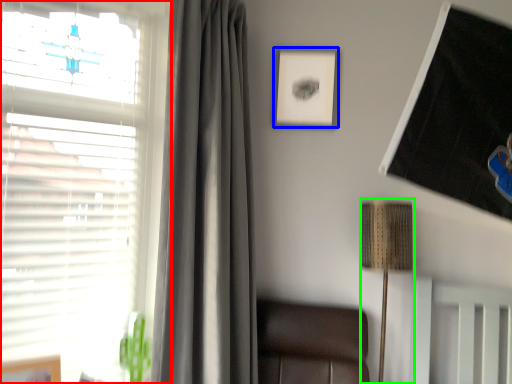
Question: Estimate the real-world distances between objects in this image. Which object is closer to window (highlighted by a red box), picture frame (highlighted by a blue box) or lamp (highlighted by a green box)?

Choices:
 (A) picture frame
 (B) lamp

Answer: (A)